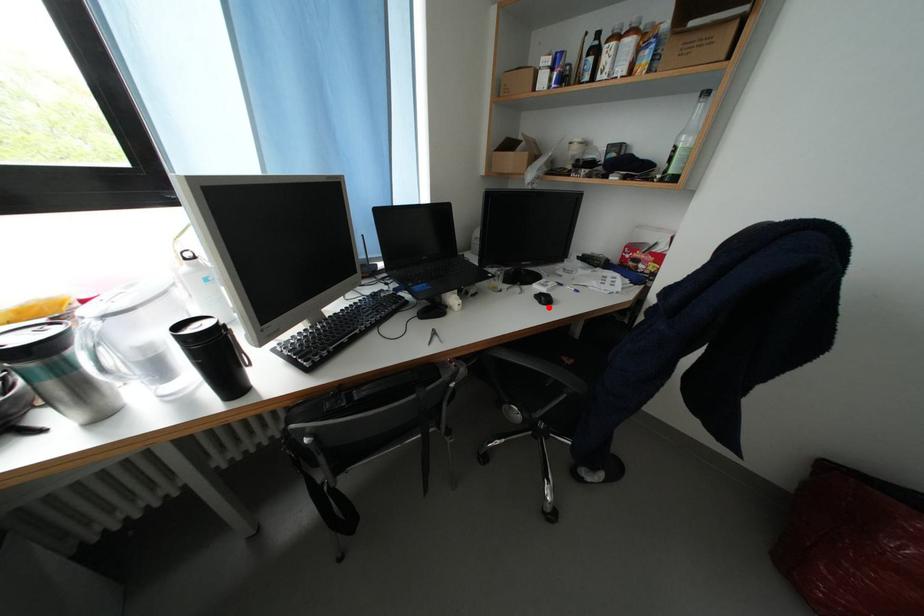
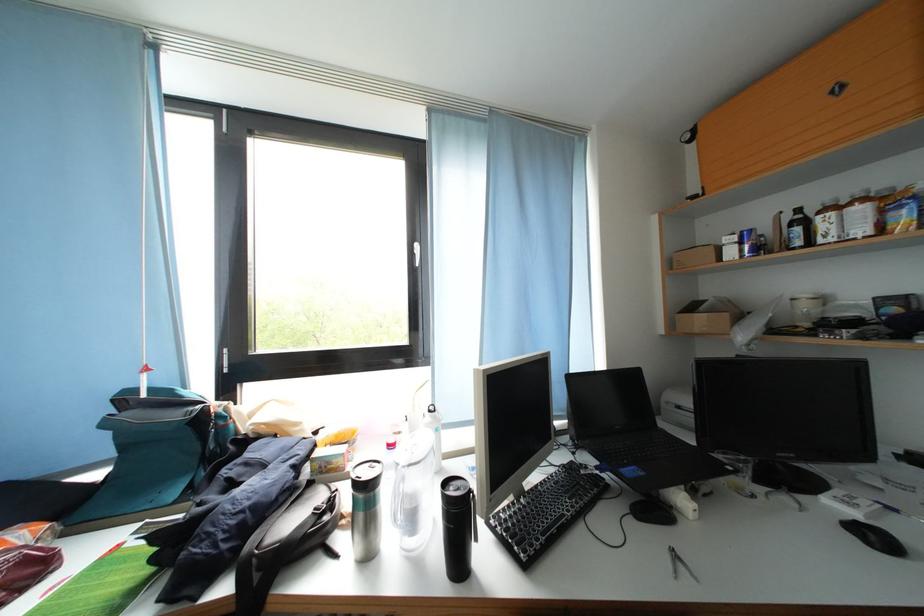
In the second image, find the point that corresponds to the highlighted location in the first image.

(877, 548)